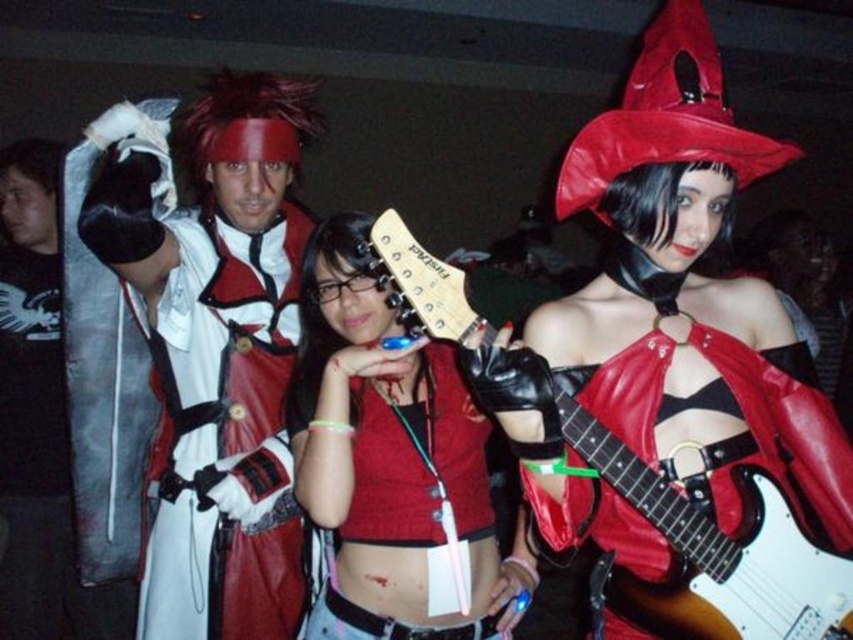
Question: Can you confirm if white leather jacket at upper left is positioned to the right of brushed metal sword at left?

Choices:
 (A) yes
 (B) no

Answer: (A)

Question: Based on their relative distances, which object is farther from the white glossy electric guitar at center?

Choices:
 (A) matte red leather jacket at center
 (B) brushed metal sword at left

Answer: (B)

Question: Does white glossy electric guitar at center have a greater width compared to brushed metal sword at left?

Choices:
 (A) yes
 (B) no

Answer: (A)

Question: Among these objects, which one is farthest from the camera?

Choices:
 (A) white leather jacket at upper left
 (B) white glossy electric guitar at center
 (C) matte red leather jacket at center

Answer: (A)

Question: Which object is positioned farthest from the brushed metal sword at left?

Choices:
 (A) matte red leather jacket at center
 (B) white glossy electric guitar at center

Answer: (B)

Question: Is white leather jacket at upper left wider than white glossy electric guitar at center?

Choices:
 (A) yes
 (B) no

Answer: (B)